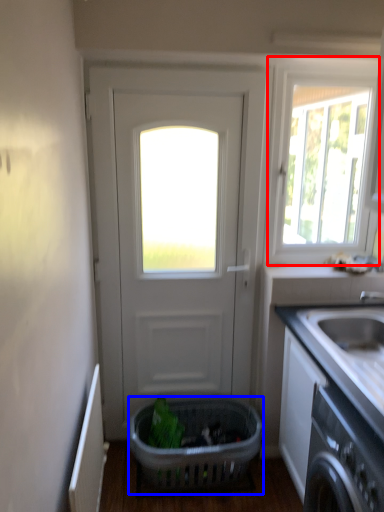
Question: Which point is closer to the camera, window (highlighted by a red box) or basket (highlighted by a blue box)?

Choices:
 (A) window
 (B) basket

Answer: (B)